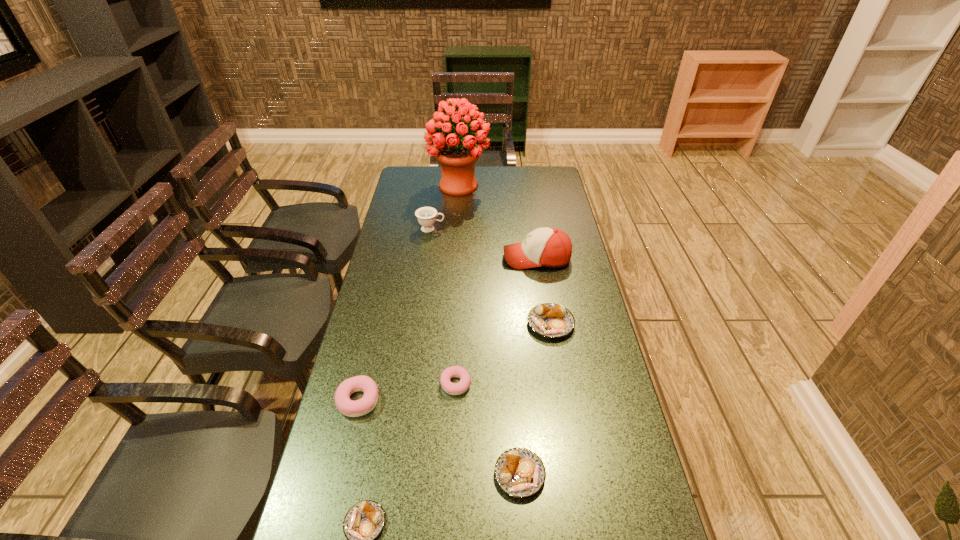
Image resolution: width=960 pixels, height=540 pixels. What are the coordinates of `free spot located on the back of the second farthest brown pastry` in the screenshot? It's located at (512, 349).

Locate an element on the screen. The width and height of the screenshot is (960, 540). blank space located on the front of the third pastry from right to left is located at coordinates (448, 539).

Locate an element on the screen. This screenshot has height=540, width=960. object located at the far edge is located at coordinates (457, 158).

Where is `bouquet that is positioned at the left edge`? bouquet that is positioned at the left edge is located at coordinates (457, 158).

The height and width of the screenshot is (540, 960). Find the location of `teacup positioned at the left edge`. teacup positioned at the left edge is located at coordinates click(x=426, y=216).

Locate an element on the screen. This screenshot has height=540, width=960. pastry that is at the left edge is located at coordinates (367, 403).

What are the coordinates of `baseball cap present at the right edge` in the screenshot? It's located at (549, 247).

Find the location of `pastry present at the right edge`. pastry present at the right edge is located at coordinates (549, 320).

Locate an element on the screen. This screenshot has height=540, width=960. object at the far left corner is located at coordinates (457, 158).

Image resolution: width=960 pixels, height=540 pixels. Identify the location of vacant area at the far edge of the desktop. (512, 168).